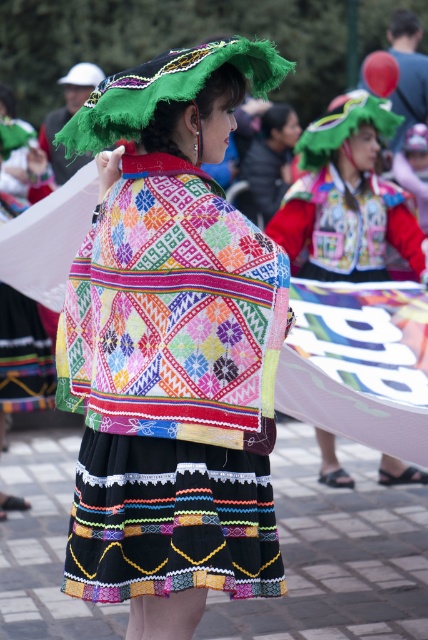
Can you confirm if green fuzzy headdress at upper center is taller than embroidered fabric blouse at center?

No.

Which is more to the left, green fuzzy headdress at upper center or embroidered fabric blouse at center?

green fuzzy headdress at upper center is more to the left.

Where is `green fuzzy headdress at upper center`? Image resolution: width=428 pixels, height=640 pixels. green fuzzy headdress at upper center is located at coordinates (165, 88).

The image size is (428, 640). Find the location of `green fuzzy headdress at upper center`. green fuzzy headdress at upper center is located at coordinates (165, 88).

Between embroidered fabric shawl at center and embroidered fabric blouse at center, which one has less height?

embroidered fabric blouse at center

Looking at this image, measure the distance between point (x=68, y=404) and camera.

Point (x=68, y=404) is 3.96 meters from camera.

Is point (172, 208) positioned behind point (253, 166)?

No, it is not.

The image size is (428, 640). I want to click on embroidered fabric shawl at center, so click(172, 348).

Is embroidered fabric shawl at center above green fuzzy headdress at upper center?

Incorrect, embroidered fabric shawl at center is not positioned above green fuzzy headdress at upper center.

Is embroidered fabric shawl at center smaller than green fuzzy headdress at upper center?

No, embroidered fabric shawl at center is not smaller than green fuzzy headdress at upper center.

Locate an element on the screen. embroidered fabric shawl at center is located at coordinates (172, 348).